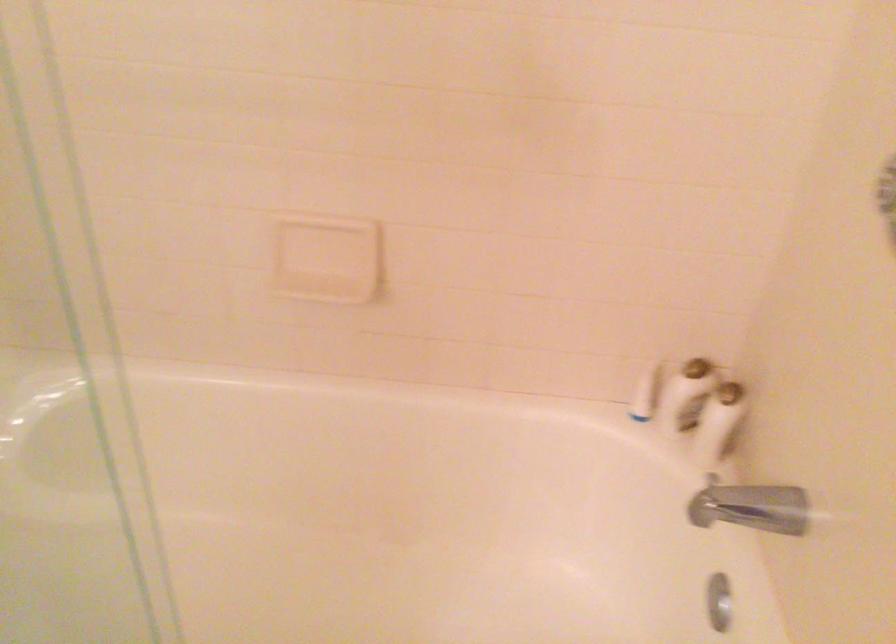
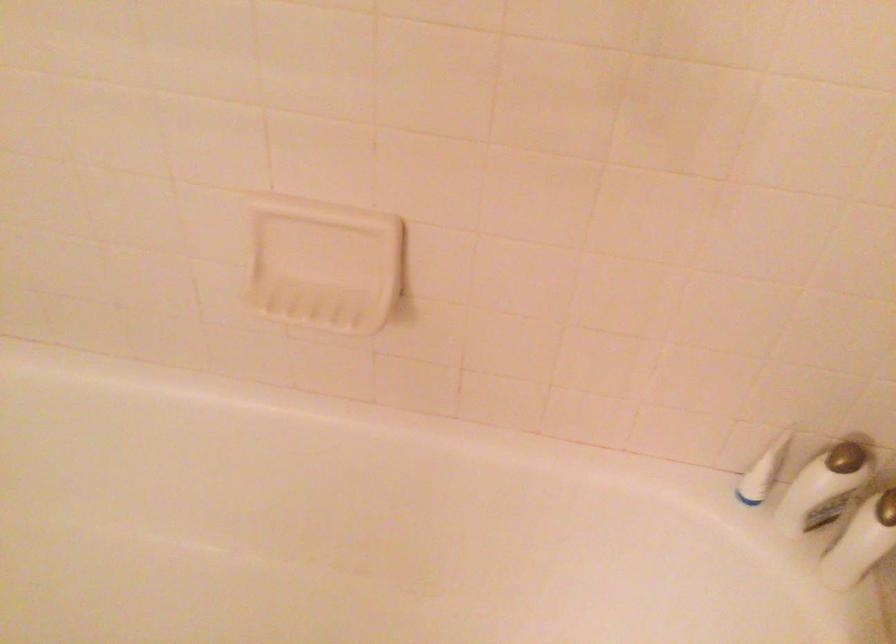
Question: The first image is from the beginning of the video and the second image is from the end. How did the camera likely rotate when shooting the video?

Choices:
 (A) Left
 (B) Right
 (C) Up
 (D) Down

Answer: (D)